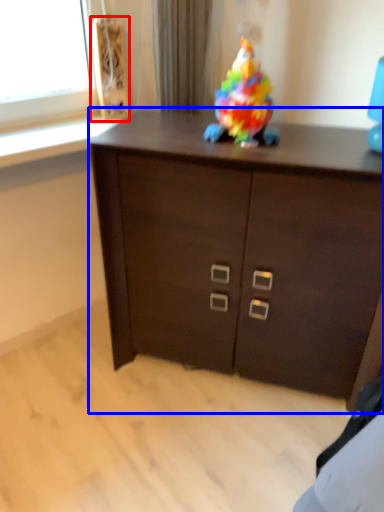
Question: Which object appears farthest to the camera in this image, speaker (highlighted by a red box) or chest of drawers (highlighted by a blue box)?

Choices:
 (A) speaker
 (B) chest of drawers

Answer: (A)